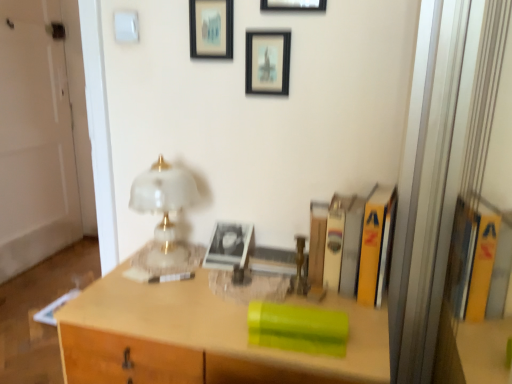
At what (x,y) coordinates should I click in order to perform the action: click on free spot to the right of green plastic container at center, marked as the 3th book in a right-to-left arrangement. Please return your answer as a coordinate pair (x, y). The width and height of the screenshot is (512, 384). Looking at the image, I should click on (364, 339).